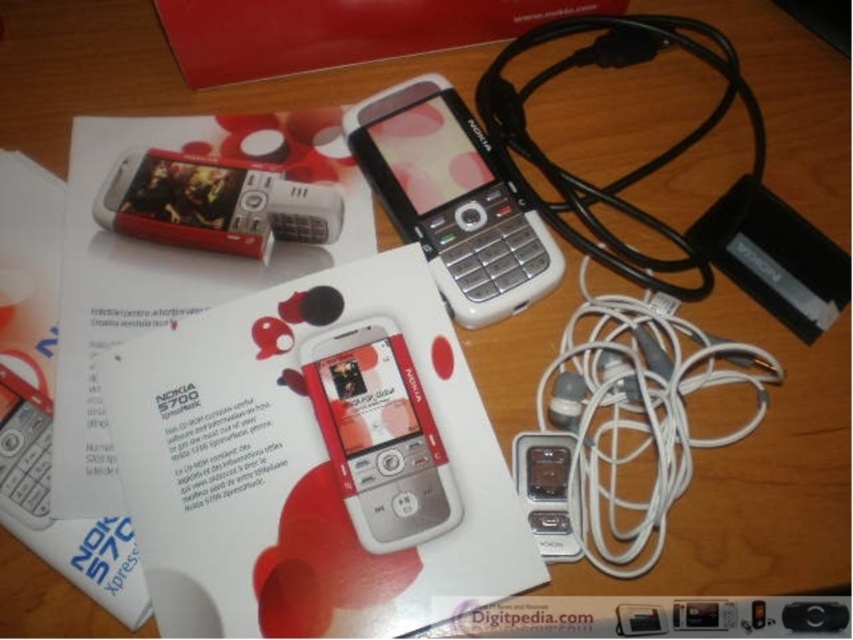
This screenshot has height=640, width=853. Identify the location of silver metallic smartphone at center. (379, 435).

The image size is (853, 640). I want to click on silver metallic smartphone at center, so click(x=379, y=435).

Between white plastic nokia phone at upper center and satin silver ipod at lower center, which one appears on the left side from the viewer's perspective?

From the viewer's perspective, white plastic nokia phone at upper center appears more on the left side.

Is white plastic nokia phone at upper center taller than satin silver ipod at lower center?

Yes.

Where is `white plastic nokia phone at upper center`? This screenshot has height=640, width=853. white plastic nokia phone at upper center is located at coordinates (213, 204).

Is the position of white matte nokia phone at center more distant than that of white plastic nokia phone at upper center?

No, white matte nokia phone at center is in front of white plastic nokia phone at upper center.

At what (x,y) coordinates should I click in order to perform the action: click on white matte nokia phone at center. Please return your answer as a coordinate pair (x, y). The height and width of the screenshot is (640, 853). Looking at the image, I should click on (451, 198).